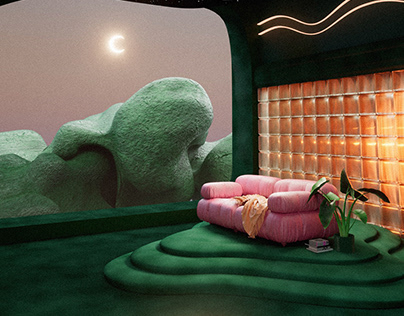
I want to click on pink couch, so click(x=290, y=219), click(x=224, y=214).